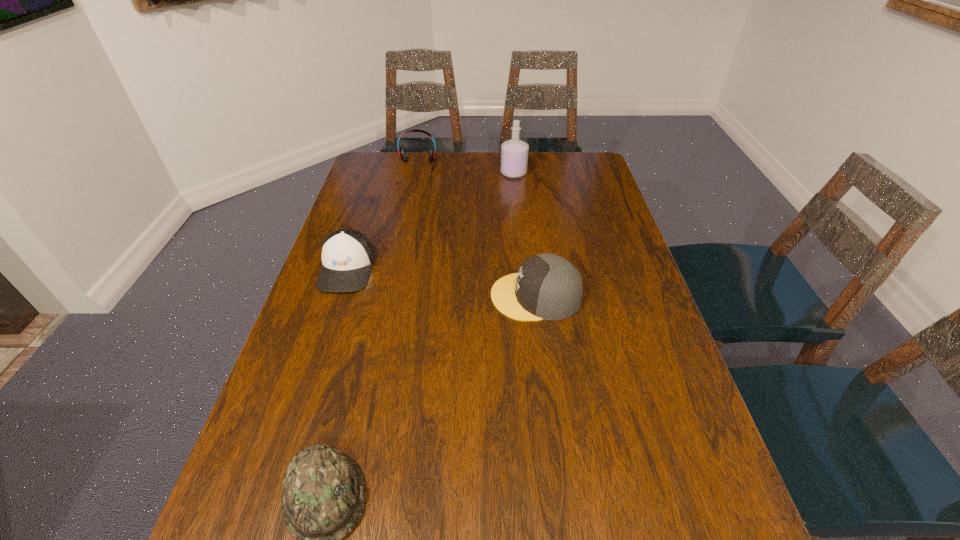
Find the location of a particular element. Image resolution: width=960 pixels, height=540 pixels. headset located at the left edge is located at coordinates [403, 155].

Find the location of a particular element. cap that is positioned at the left edge is located at coordinates (347, 255).

The width and height of the screenshot is (960, 540). In order to click on object located at the far left corner in this screenshot , I will do `click(403, 155)`.

Identify the location of free space at the far edge. (409, 167).

At what (x,y) coordinates should I click in order to perform the action: click on free point at the left edge. Please return your answer as a coordinate pair (x, y). Looking at the image, I should click on (386, 196).

Locate an element on the screen. The height and width of the screenshot is (540, 960). free space at the right edge of the desktop is located at coordinates pos(622,369).

The width and height of the screenshot is (960, 540). Find the location of `free space at the far left corner of the desktop`. free space at the far left corner of the desktop is located at coordinates (381, 178).

This screenshot has width=960, height=540. I want to click on vacant area that lies between the tallest object and the rightmost headwear, so click(524, 234).

Identify the location of free spot between the perfume and the rightmost headwear. The height and width of the screenshot is (540, 960). (524, 234).

Where is `object that is the closest to the perfume`? The width and height of the screenshot is (960, 540). object that is the closest to the perfume is located at coordinates (403, 155).